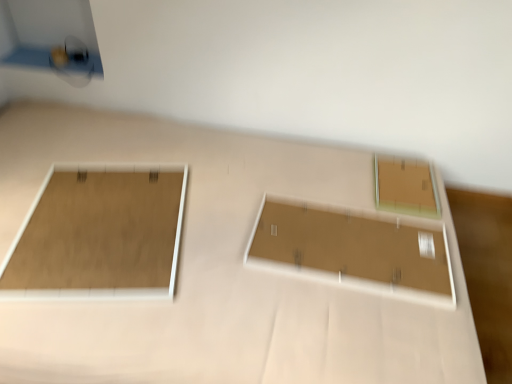
Question: Can matte brown frame at upper right, acting as the first rectangle starting from the right, be found inside matte brown frame at left, the third rectangle positioned from the right?

Choices:
 (A) yes
 (B) no

Answer: (B)

Question: Can you confirm if matte brown frame at left, which ranks as the 1th rectangle in left-to-right order, is positioned to the right of matte brown frame at upper right, acting as the first rectangle starting from the right?

Choices:
 (A) yes
 (B) no

Answer: (B)

Question: Is matte brown frame at left, which ranks as the 1th rectangle in left-to-right order, bigger than matte brown frame at upper right, marked as the third rectangle in a left-to-right arrangement?

Choices:
 (A) no
 (B) yes

Answer: (B)

Question: From the image's perspective, is matte brown frame at left, which ranks as the 1th rectangle in left-to-right order, located beneath matte brown frame at upper right, acting as the first rectangle starting from the right?

Choices:
 (A) no
 (B) yes

Answer: (B)

Question: Is matte brown frame at left, which ranks as the 1th rectangle in left-to-right order, not near matte brown frame at upper right, marked as the third rectangle in a left-to-right arrangement?

Choices:
 (A) no
 (B) yes

Answer: (A)

Question: Is matte brown frame at left, which ranks as the 1th rectangle in left-to-right order, oriented away from matte brown frame at upper right, marked as the third rectangle in a left-to-right arrangement?

Choices:
 (A) no
 (B) yes

Answer: (A)

Question: From a real-world perspective, does matte brown frame at left, the third rectangle positioned from the right, sit lower than matte brown board at center, arranged as the second rectangle when viewed from the right?

Choices:
 (A) no
 (B) yes

Answer: (A)

Question: Does matte brown frame at left, the third rectangle positioned from the right, come in front of matte brown board at center, arranged as the second rectangle when viewed from the right?

Choices:
 (A) no
 (B) yes

Answer: (B)

Question: Does matte brown frame at left, the third rectangle positioned from the right, have a smaller size compared to matte brown board at center, the second rectangle when ordered from left to right?

Choices:
 (A) no
 (B) yes

Answer: (A)

Question: Is matte brown frame at left, which ranks as the 1th rectangle in left-to-right order, aimed at matte brown board at center, arranged as the second rectangle when viewed from the right?

Choices:
 (A) no
 (B) yes

Answer: (A)

Question: Is matte brown frame at left, the third rectangle positioned from the right, wider than matte brown board at center, the second rectangle when ordered from left to right?

Choices:
 (A) no
 (B) yes

Answer: (A)

Question: Are matte brown frame at left, the third rectangle positioned from the right, and matte brown board at center, the second rectangle when ordered from left to right, located far from each other?

Choices:
 (A) no
 (B) yes

Answer: (A)

Question: From the image's perspective, is matte brown board at center, arranged as the second rectangle when viewed from the right, on matte brown frame at left, which ranks as the 1th rectangle in left-to-right order?

Choices:
 (A) no
 (B) yes

Answer: (A)